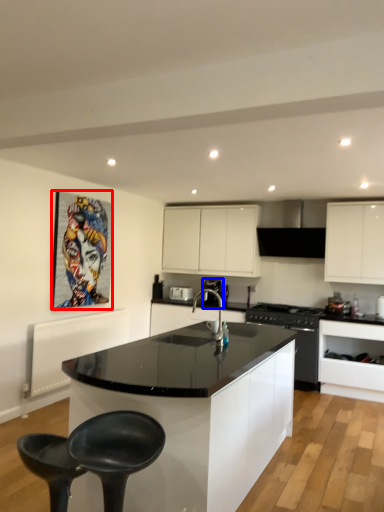
Question: Which of the following is the closest to the observer, picture frame (highlighted by a red box) or coffee machine (highlighted by a blue box)?

Choices:
 (A) picture frame
 (B) coffee machine

Answer: (A)